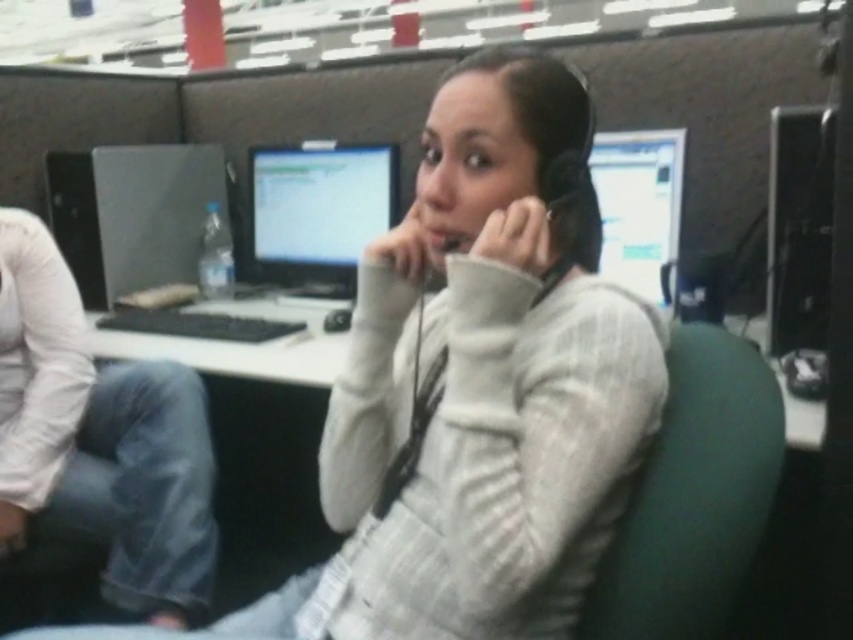
Can you confirm if white plastic computer desk at center is wider than matte black monitor at upper right?

Yes, white plastic computer desk at center is wider than matte black monitor at upper right.

Is point (799, 429) positioned before point (654, 173)?

Yes.

At what (x,y) coordinates should I click in order to perform the action: click on white plastic computer desk at center. Please return your answer as a coordinate pair (x, y). This screenshot has height=640, width=853. Looking at the image, I should click on (241, 344).

Is the position of white cotton sweater at center less distant than that of white plastic computer desk at center?

Yes.

Is white cotton sweater at center shorter than white plastic computer desk at center?

In fact, white cotton sweater at center may be taller than white plastic computer desk at center.

Who is more forward, (x=16, y=458) or (x=329, y=355)?

Point (x=16, y=458) is in front.

Identify the location of white cotton sweater at center. This screenshot has width=853, height=640. (99, 438).

Does white textured sweater at center have a larger size compared to black plastic desktop computer at right?

Correct, white textured sweater at center is larger in size than black plastic desktop computer at right.

Describe the element at coordinates (479, 385) in the screenshot. This screenshot has height=640, width=853. I see `white textured sweater at center` at that location.

Locate an element on the screen. The width and height of the screenshot is (853, 640). white textured sweater at center is located at coordinates (479, 385).